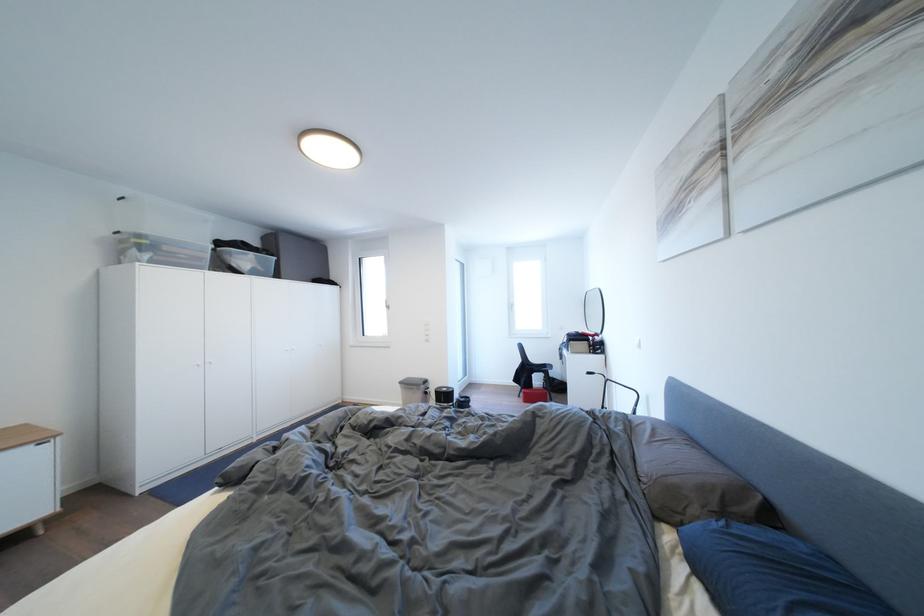
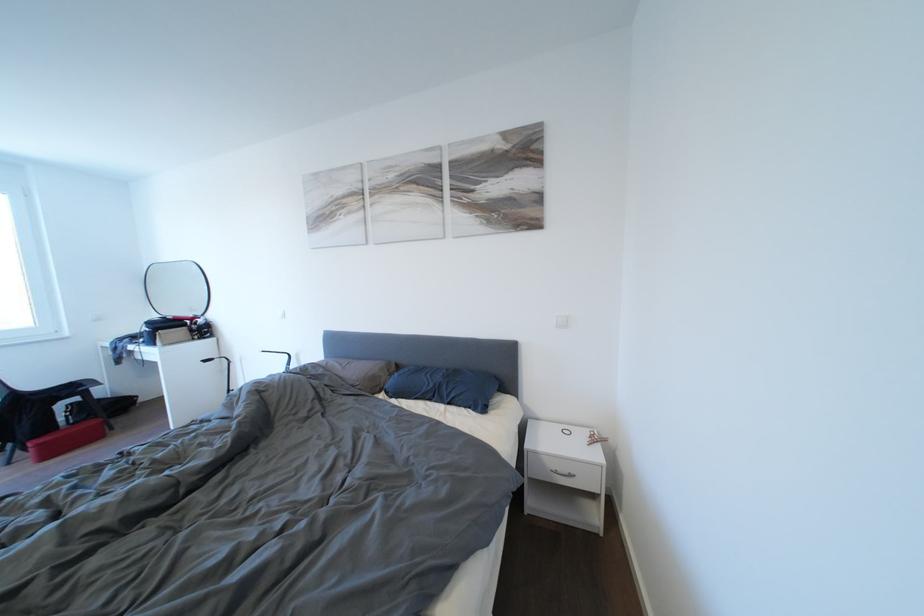
Where in the second image is the point corresponding to pixel 532 398 from the first image?

(46, 450)